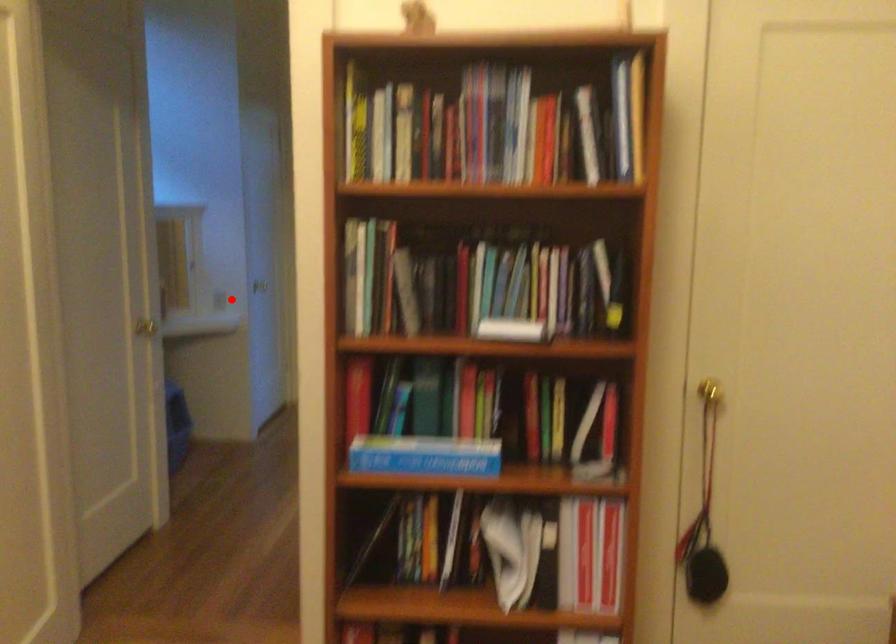
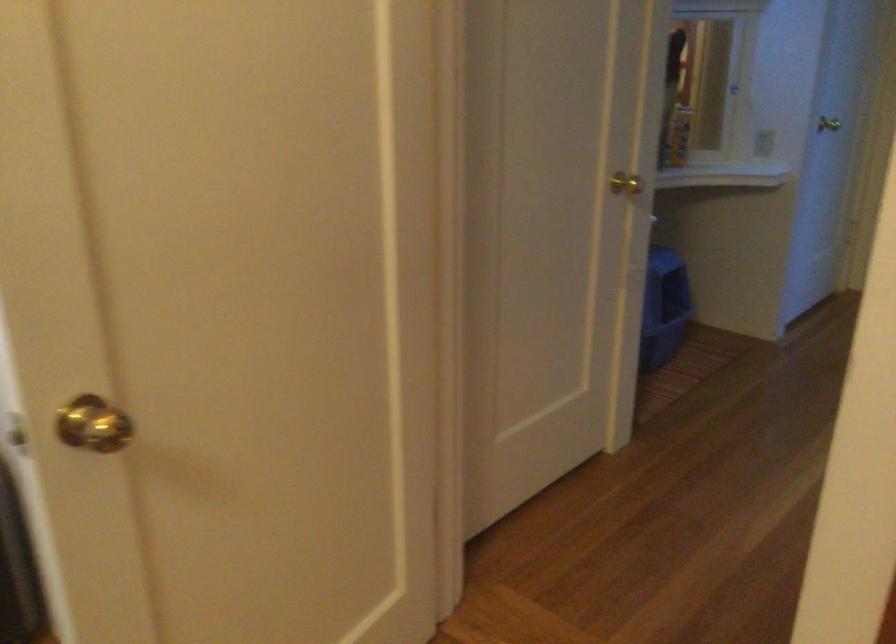
Find the pixel in the second image that matches the highlighted location in the first image.

(762, 143)